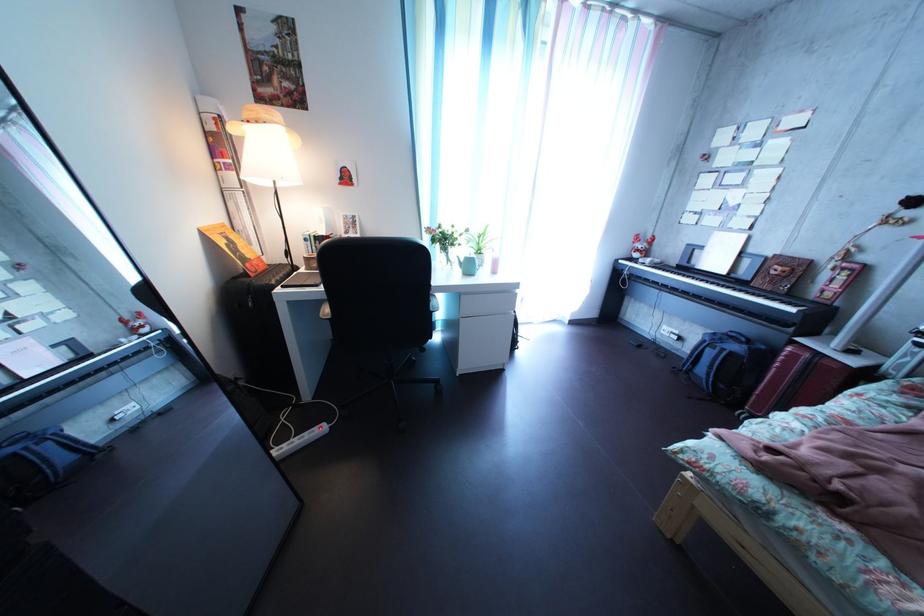
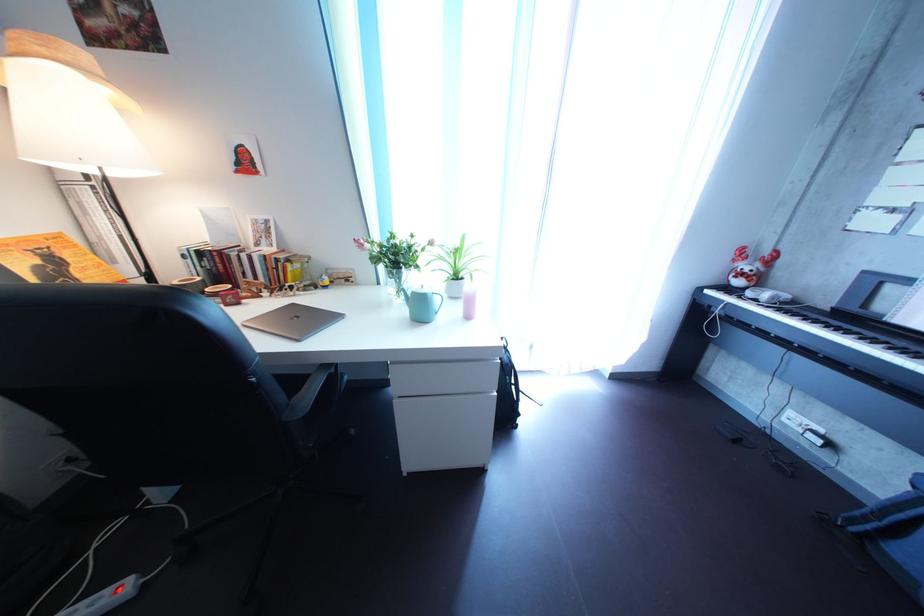
In the second image, find the point that corresponds to point (493, 261) in the first image.

(469, 285)